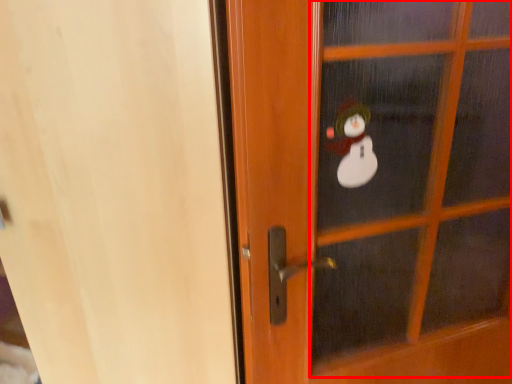
Question: Observing the image, what is the correct spatial positioning of screen door (annotated by the red box) in reference to screen door?

Choices:
 (A) left
 (B) right

Answer: (B)